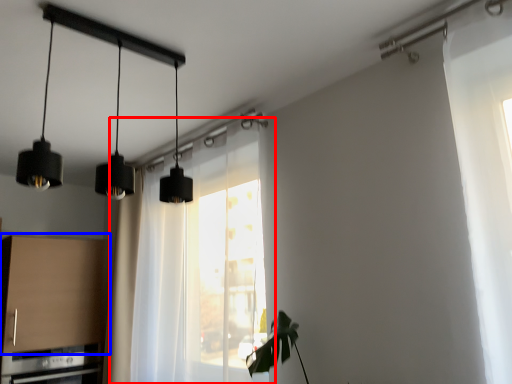
Question: Which object appears farthest to the camera in this image, window (highlighted by a red box) or cabinetry (highlighted by a blue box)?

Choices:
 (A) window
 (B) cabinetry

Answer: (B)